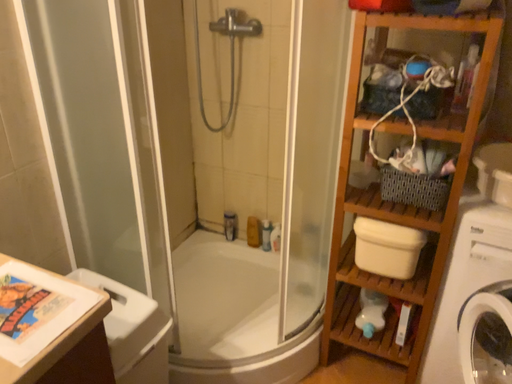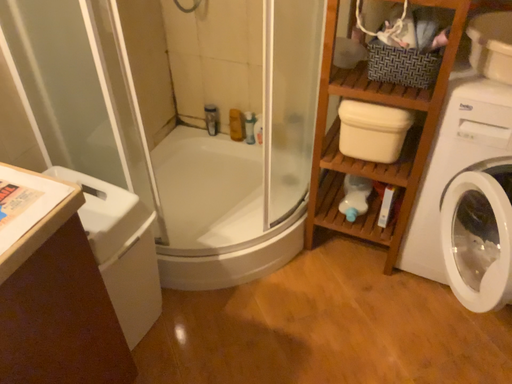
Question: How did the camera likely rotate when shooting the video?

Choices:
 (A) rotated downward
 (B) rotated upward

Answer: (A)